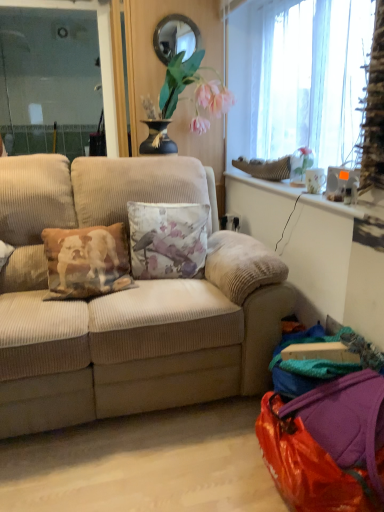
Question: From a real-world perspective, is shiny orange bag at lower right positioned over matte glass mirror at upper center based on gravity?

Choices:
 (A) no
 (B) yes

Answer: (A)

Question: Is shiny orange bag at lower right to the left of matte glass mirror at upper center from the viewer's perspective?

Choices:
 (A) no
 (B) yes

Answer: (A)

Question: Is shiny orange bag at lower right oriented towards matte glass mirror at upper center?

Choices:
 (A) yes
 (B) no

Answer: (B)

Question: Is shiny orange bag at lower right next to matte glass mirror at upper center?

Choices:
 (A) yes
 (B) no

Answer: (B)

Question: Can we say shiny orange bag at lower right lies outside matte glass mirror at upper center?

Choices:
 (A) yes
 (B) no

Answer: (A)

Question: Would you say shiny orange bag at lower right is a long distance from matte glass mirror at upper center?

Choices:
 (A) yes
 (B) no

Answer: (A)

Question: From a real-world perspective, is beige corduroy couch at center physically above matte glass mirror at upper center?

Choices:
 (A) no
 (B) yes

Answer: (A)

Question: Is beige corduroy couch at center far away from matte glass mirror at upper center?

Choices:
 (A) no
 (B) yes

Answer: (B)

Question: Does beige corduroy couch at center appear on the left side of matte glass mirror at upper center?

Choices:
 (A) no
 (B) yes

Answer: (B)

Question: Does beige corduroy couch at center have a lesser height compared to matte glass mirror at upper center?

Choices:
 (A) yes
 (B) no

Answer: (B)

Question: From a real-world perspective, is beige corduroy couch at center physically below matte glass mirror at upper center?

Choices:
 (A) no
 (B) yes

Answer: (B)

Question: Does beige corduroy couch at center appear on the right side of matte glass mirror at upper center?

Choices:
 (A) no
 (B) yes

Answer: (A)

Question: Does floral fabric cushion at center have a lesser width compared to shiny orange bag at lower right?

Choices:
 (A) yes
 (B) no

Answer: (A)